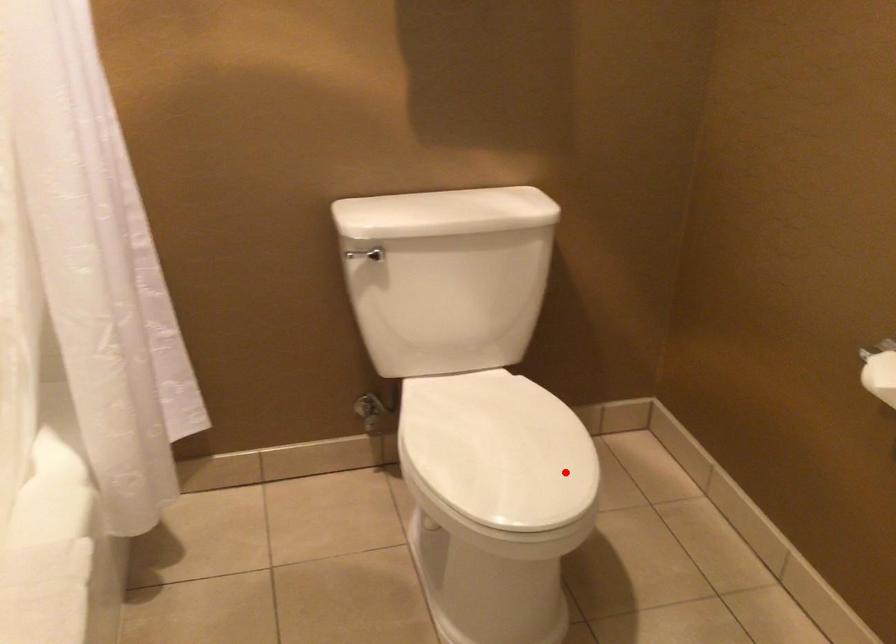
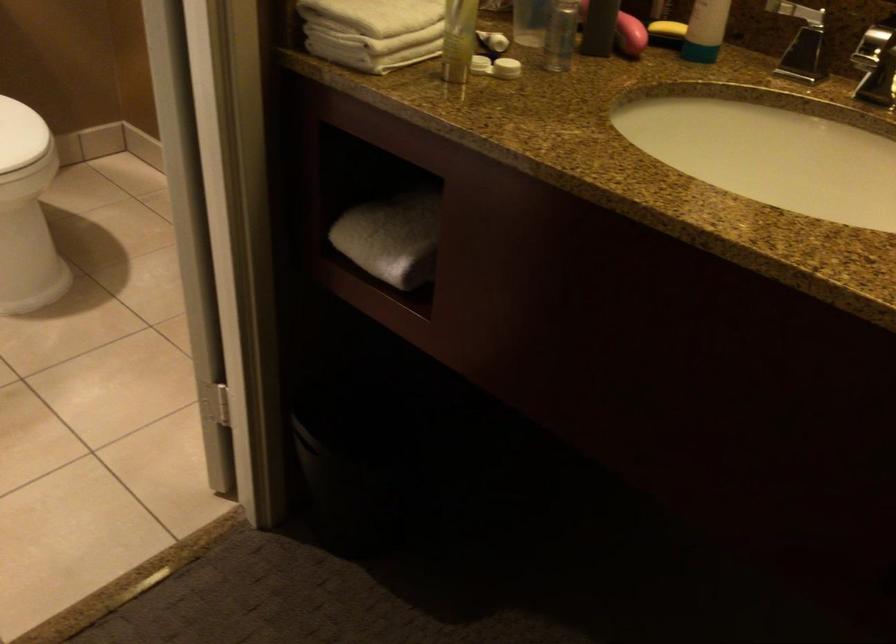
Question: I am providing you with two images of the same scene from different viewpoints. Image1 has a red point marked. In image2, the corresponding 3D location appears at what relative position? Reply with the corresponding letter.

Choices:
 (A) Closer
 (B) Farther

Answer: (B)